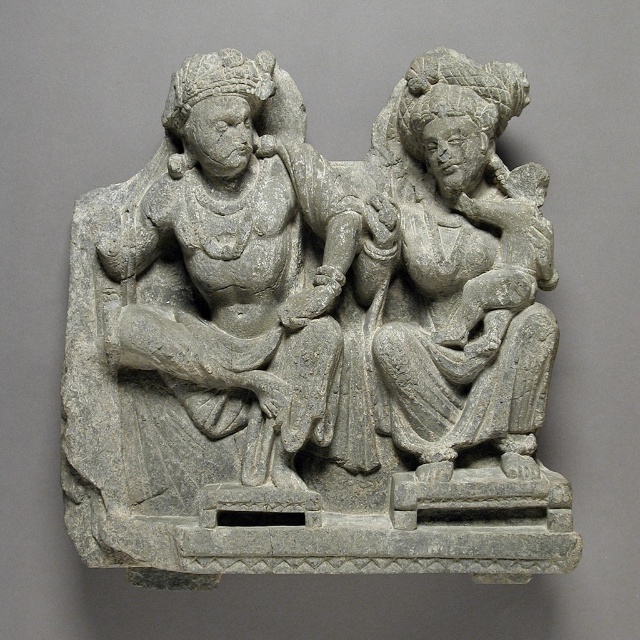
Question: Is gray stone statue at left positioned behind gray stone statue at right?

Choices:
 (A) yes
 (B) no

Answer: (A)

Question: Which is nearer to the gray stone sculpture at center?

Choices:
 (A) gray stone statue at left
 (B) gray stone statue at right

Answer: (A)

Question: Which of the following is the farthest from the observer?

Choices:
 (A) (138, 573)
 (B) (436, 396)

Answer: (B)

Question: Does gray stone statue at left appear under gray stone statue at right?

Choices:
 (A) yes
 (B) no

Answer: (A)

Question: Is gray stone statue at left wider than gray stone statue at right?

Choices:
 (A) no
 (B) yes

Answer: (B)

Question: Which point appears closest to the camera in this image?

Choices:
 (A) (241, 330)
 (B) (472, 420)
 (C) (536, 289)

Answer: (C)